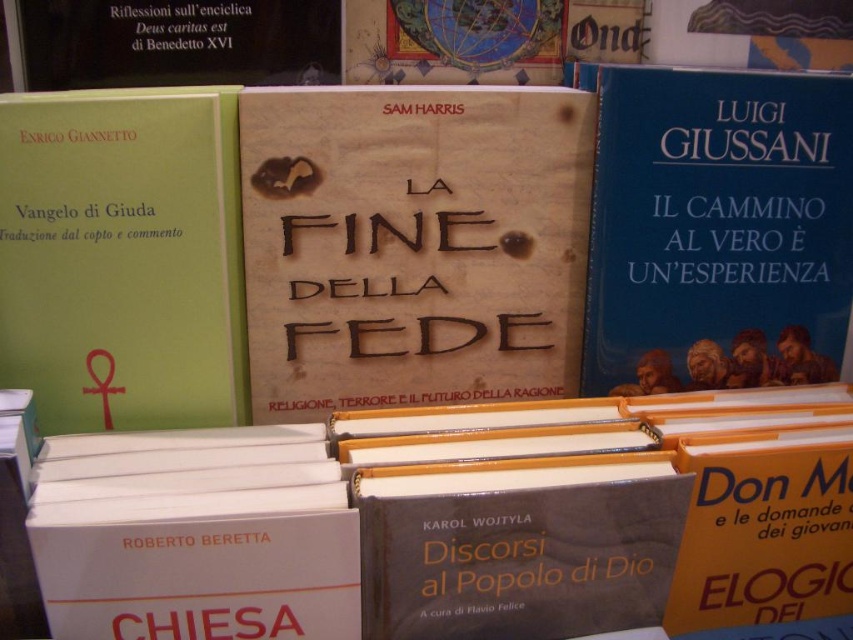
Question: In this image, where is beige paper book at center located relative to green matte book at left?

Choices:
 (A) above
 (B) below

Answer: (A)

Question: Which object appears closest to the camera in this image?

Choices:
 (A) beige paper book at center
 (B) green matte book at left

Answer: (B)

Question: Which point is farther to the camera?

Choices:
 (A) green matte book at left
 (B) blue matte book at right

Answer: (B)

Question: Does beige paper book at center appear over blue matte book at right?

Choices:
 (A) no
 (B) yes

Answer: (A)

Question: Which object appears farthest from the camera in this image?

Choices:
 (A) green matte book at left
 (B) beige paper book at center

Answer: (B)

Question: Can you confirm if beige paper book at center is wider than green matte book at left?

Choices:
 (A) yes
 (B) no

Answer: (A)